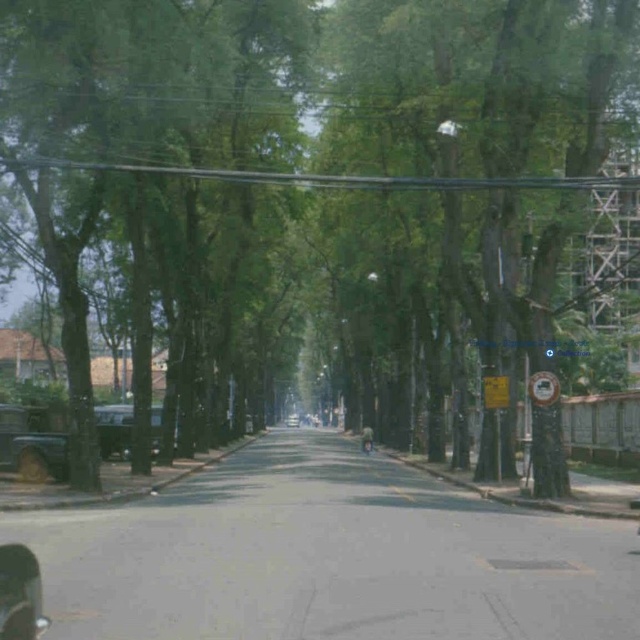
You are a delivery person trying to navigate through the street. There is a metallic wire at upper center and a metallic silver car at center. Which object is bigger in size?

The metallic wire at upper center is larger in size compared to the metallic silver car at center.

You are a pedestrian standing on the sidewalk on the right side of the street. You want to cross to the parked cars on the left. Which direction should you walk to reach the metallic silver car at center first, passing by the green leafy tree at left?

You should walk to the left because the green leafy tree at left is to the left of the metallic silver car at center, so moving left from the sidewalk will first lead you past the tree and then to the metallic silver car at center.

You are a delivery person trying to navigate through the street. There is a metallic wire at upper center and a metallic silver car at center. Which object is higher from the ground?

The metallic wire at upper center is much taller than the metallic silver car at center, so the metallic wire at upper center is higher from the ground.